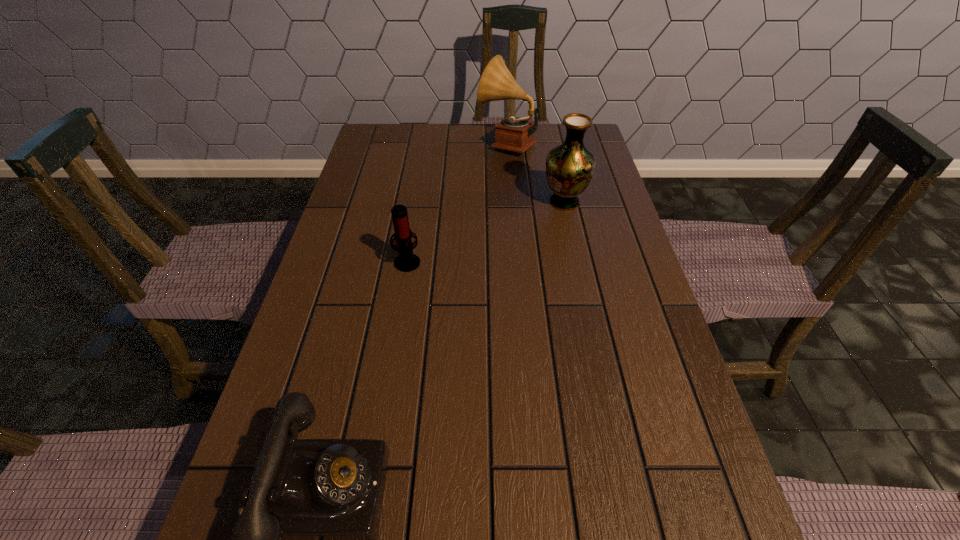
Where is `vacant region at the far edge of the desktop`? Image resolution: width=960 pixels, height=540 pixels. vacant region at the far edge of the desktop is located at coordinates (435, 127).

The height and width of the screenshot is (540, 960). I want to click on free space at the left edge of the desktop, so click(340, 245).

Where is `free point at the right edge`? free point at the right edge is located at coordinates (679, 471).

The image size is (960, 540). I want to click on free space between the third nearest object and the microphone, so click(x=486, y=232).

This screenshot has width=960, height=540. Identify the location of blank region between the phonograph record and the third farthest object. (457, 202).

Identify the location of vacant space in between the farthest object and the microphone. The height and width of the screenshot is (540, 960). point(457,202).

Identify which object is the nearest to the microphone. Please provide its 2D coordinates. Your answer should be formatted as a tuple, i.e. [(x, y)], where the tuple contains the x and y coordinates of a point satisfying the conditions above.

[(570, 166)]

The image size is (960, 540). In order to click on the third closest object relative to the vase in this screenshot , I will do `click(306, 539)`.

Image resolution: width=960 pixels, height=540 pixels. In order to click on vacant area in the image that satisfies the following two spatial constraints: 1. on the horn of the vase; 2. on the left side of the phonograph record in this screenshot , I will do `click(512, 202)`.

The width and height of the screenshot is (960, 540). Identify the location of vacant space that satisfies the following two spatial constraints: 1. on the horn of the phonograph record; 2. on the right side of the second farthest object. (512, 202).